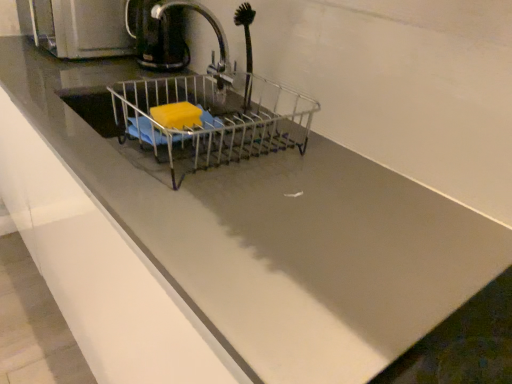
Question: From a real-world perspective, is black plastic coffee pot at upper left positioned above or below metallic silver kettle at upper left?

Choices:
 (A) above
 (B) below

Answer: (A)

Question: Looking at the image, does black plastic coffee pot at upper left seem bigger or smaller compared to metallic silver kettle at upper left?

Choices:
 (A) big
 (B) small

Answer: (B)

Question: Which object is positioned closest to the metallic faucet at center?

Choices:
 (A) black rubber brush at upper center
 (B) black plastic coffee pot at upper left
 (C) metallic wire basket at center
 (D) metallic silver kettle at upper left

Answer: (B)

Question: Which is nearer to the metallic wire basket at center?

Choices:
 (A) black plastic coffee pot at upper left
 (B) metallic faucet at center
 (C) metallic silver kettle at upper left
 (D) black rubber brush at upper center

Answer: (D)